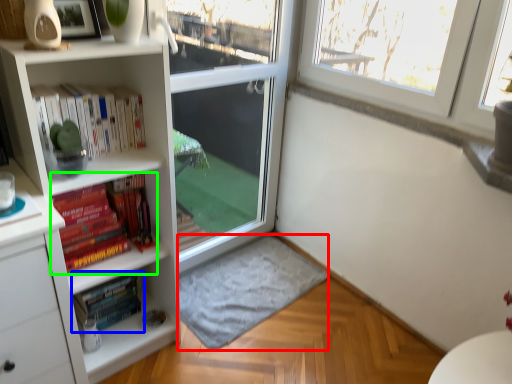
Question: Which object is positioned farthest from wide (highlighted by a red box)? Select from book (highlighted by a blue box) and book (highlighted by a green box).

Choices:
 (A) book
 (B) book

Answer: (B)